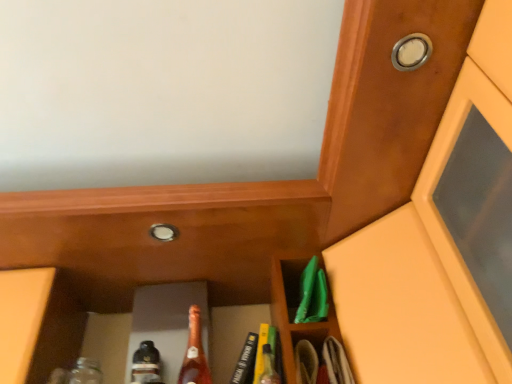
Question: Relative to matte brown cabinet at center, is wooden door at upper right in front or behind?

Choices:
 (A) behind
 (B) front

Answer: (B)

Question: From the image's perspective, relative to matte brown cabinet at center, is wooden door at upper right above or below?

Choices:
 (A) above
 (B) below

Answer: (A)

Question: Which object is the farthest from the silver metallic knob at center, which is the 2th knob in right-to-left order?

Choices:
 (A) metallic silver knob at upper right, the 2th knob from the back
 (B) translucent glass bottle at center
 (C) matte glass bottle at center
 (D) matte brown cabinet at center
 (E) wooden door at upper right

Answer: (A)

Question: Estimate the real-world distances between objects in this image. Which object is farther from the metallic silver knob at upper right, marked as the first knob in a top-to-bottom arrangement?

Choices:
 (A) matte glass bottle at center
 (B) silver metallic knob at center, which ranks as the second knob in front-to-back order
 (C) matte brown cabinet at center
 (D) translucent glass bottle at center
 (E) wooden door at upper right

Answer: (A)